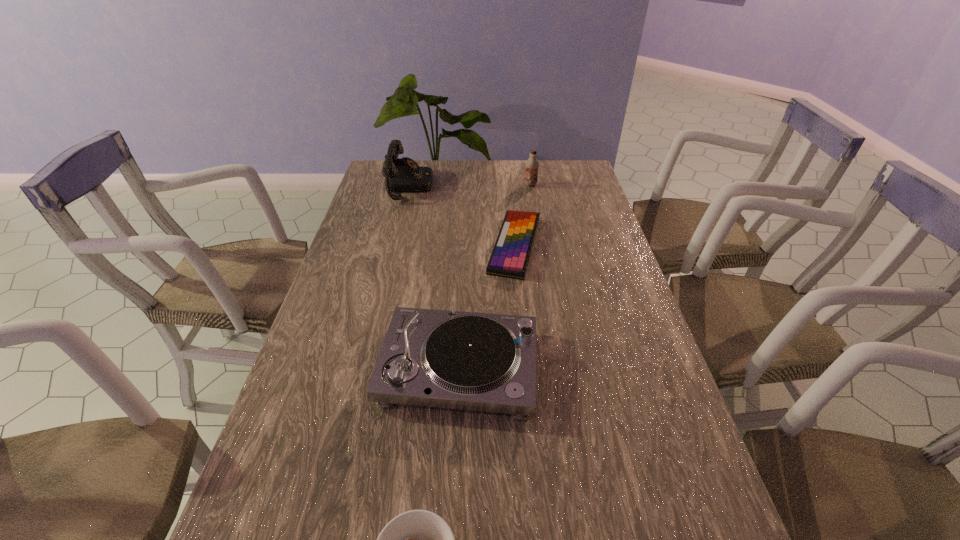
Locate an element on the screen. telephone is located at coordinates (401, 175).

Identify the location of chocolate milk. The image size is (960, 540). (532, 164).

At what (x,y) coordinates should I click in order to perform the action: click on the fourth farthest object. Please return your answer as a coordinate pair (x, y). This screenshot has width=960, height=540. Looking at the image, I should click on (485, 362).

Where is `record player`? record player is located at coordinates (485, 362).

Identify the location of the shortest object. Image resolution: width=960 pixels, height=540 pixels. coord(511,253).

At what (x,y) coordinates should I click in order to perform the action: click on computer keyboard. Please return your answer as a coordinate pair (x, y). Looking at the image, I should click on [511, 253].

This screenshot has width=960, height=540. I want to click on free spot located on the dial of the telephone, so click(512, 186).

Where is `blank area located 0.180m on the back of the chocolate milk`? The width and height of the screenshot is (960, 540). blank area located 0.180m on the back of the chocolate milk is located at coordinates (527, 161).

At what (x,y) coordinates should I click in order to perform the action: click on free space located 0.070m on the left of the record player. Please return your answer as a coordinate pair (x, y). The width and height of the screenshot is (960, 540). Looking at the image, I should click on (349, 367).

Locate an element on the screen. The width and height of the screenshot is (960, 540). vacant area located on the back of the third farthest object is located at coordinates (508, 179).